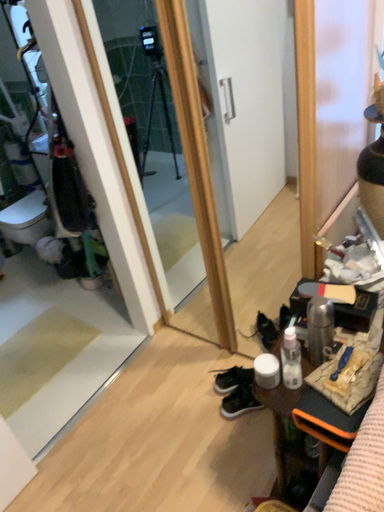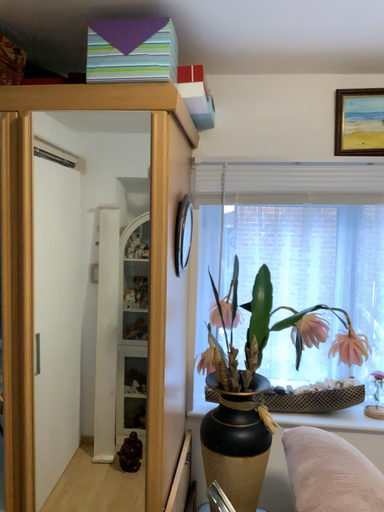
Question: Which way did the camera rotate in the video?

Choices:
 (A) rotated upward
 (B) rotated downward

Answer: (A)